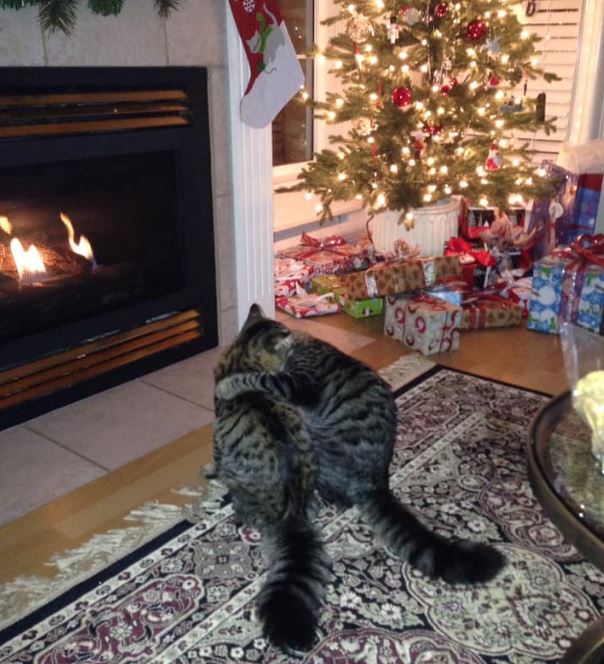
At what (x,y) coordinates should I click in order to perform the action: click on stone tiles in front of fireplace. Please return your answer as a coordinate pair (x, y). Looking at the image, I should click on click(x=184, y=382), click(x=152, y=412), click(x=60, y=461).